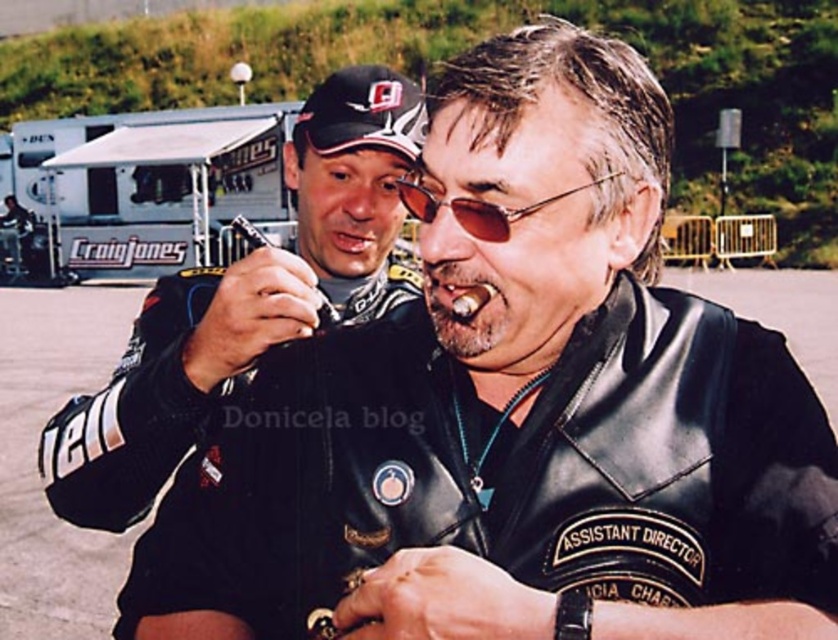
Is black leather jacket at center to the right of black fabric baseball cap at upper center from the viewer's perspective?

Correct, you'll find black leather jacket at center to the right of black fabric baseball cap at upper center.

Is black leather jacket at center further to camera compared to black fabric baseball cap at upper center?

No, it is not.

Locate an element on the screen. The width and height of the screenshot is (838, 640). black leather jacket at center is located at coordinates (508, 472).

The image size is (838, 640). Find the location of `black leather jacket at center`. black leather jacket at center is located at coordinates (508, 472).

Which is in front, point (348, 202) or point (375, 97)?

Point (375, 97)

Can you confirm if black leather jacket at left is thinner than black fabric baseball cap at upper center?

No.

What are the coordinates of `black leather jacket at left` in the screenshot? It's located at (246, 301).

Is black leather jacket at center below white canvas trailer at upper left?

Indeed, black leather jacket at center is positioned under white canvas trailer at upper left.

Between point (386, 522) and point (53, 266), which one is positioned in front?

Point (386, 522) is more forward.

Find the location of `black leather jacket at center`. black leather jacket at center is located at coordinates (508, 472).